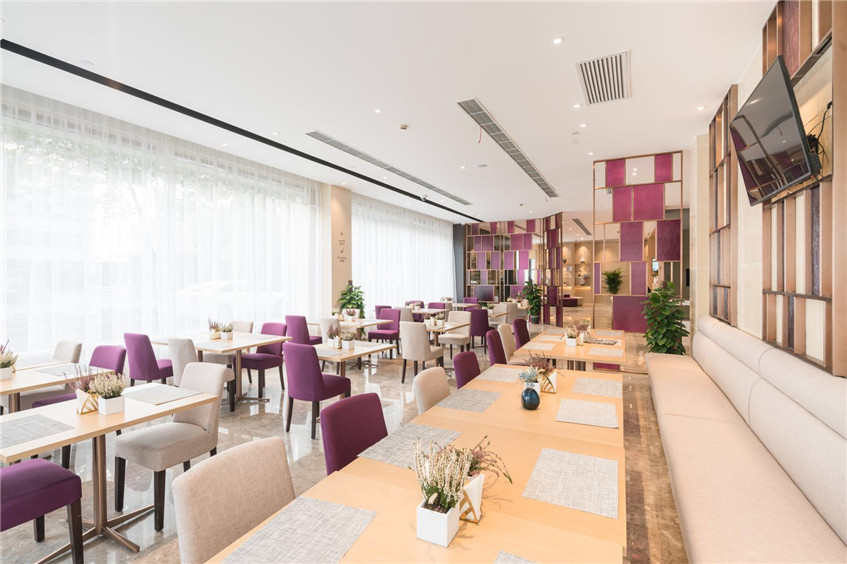
This screenshot has height=564, width=847. In order to click on dining tables in this screenshot , I will do `click(96, 431)`, `click(35, 378)`, `click(224, 343)`, `click(339, 355)`, `click(452, 323)`, `click(367, 321)`, `click(493, 317)`.